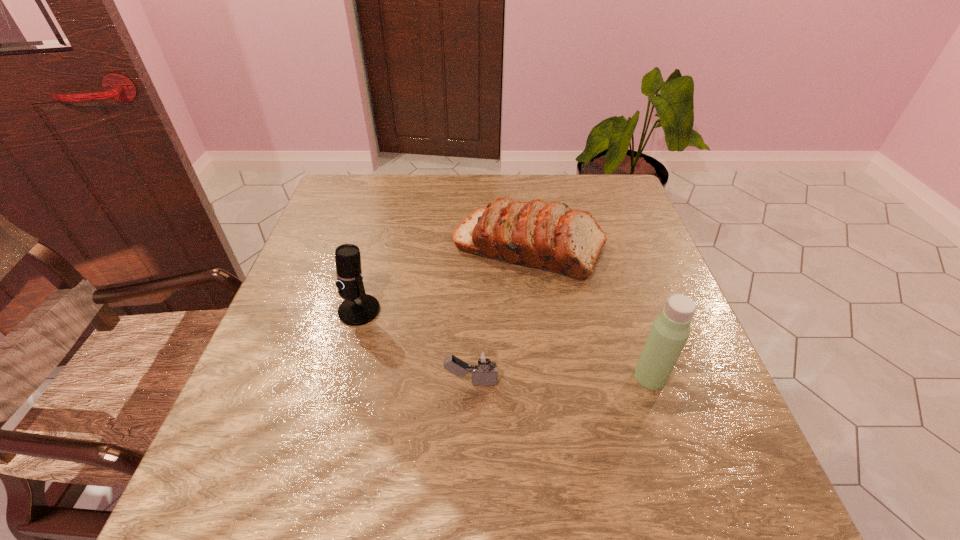
Locate an element on the screen. the third closest object to the bread is located at coordinates (484, 362).

The image size is (960, 540). What are the coordinates of `the third closest object relative to the shortest object` in the screenshot? It's located at (670, 330).

Identify the location of free location that satisfies the following two spatial constraints: 1. on the front side of the tallest object; 2. on the right side of the bread. Image resolution: width=960 pixels, height=540 pixels. (546, 377).

Identify the location of free space that satisfies the following two spatial constraints: 1. on the front side of the tallest object; 2. on the left side of the leftmost object. The width and height of the screenshot is (960, 540). (342, 377).

You are a GUI agent. You are given a task and a screenshot of the screen. Output one action in this format:
    pyautogui.click(x=<x>, y=<y>)
    Task: Click on the vacant area that satisfies the following two spatial constraints: 1. on the front side of the leftmost object; 2. on the left side of the igniter
    The image size is (960, 540).
    Given the screenshot: What is the action you would take?
    pyautogui.click(x=340, y=382)